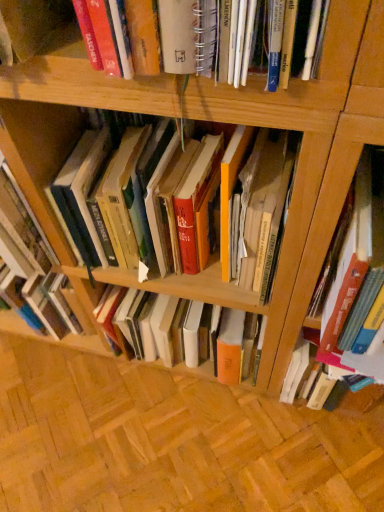
Question: Visually, is hardcover book at right, the second book viewed from the right, positioned to the left or to the right of hardcover book at center, which appears as the third book when viewed from the right?

Choices:
 (A) right
 (B) left

Answer: (A)

Question: In terms of width, does hardcover book at right, the second book viewed from the right, look wider or thinner when compared to hardcover book at center, which appears as the third book when viewed from the right?

Choices:
 (A) thin
 (B) wide

Answer: (B)

Question: Which object is positioned closest to the hardcover book at right, the 1th book from the right?

Choices:
 (A) hardcover book at center, the first book from the left
 (B) hardcover book at right, marked as the 2th book in a left-to-right arrangement

Answer: (B)

Question: Estimate the real-world distances between objects in this image. Which object is closer to the hardcover book at right, the second book viewed from the right?

Choices:
 (A) hardcover book at right, which is the third book in left-to-right order
 (B) hardcover book at center, which appears as the third book when viewed from the right

Answer: (A)